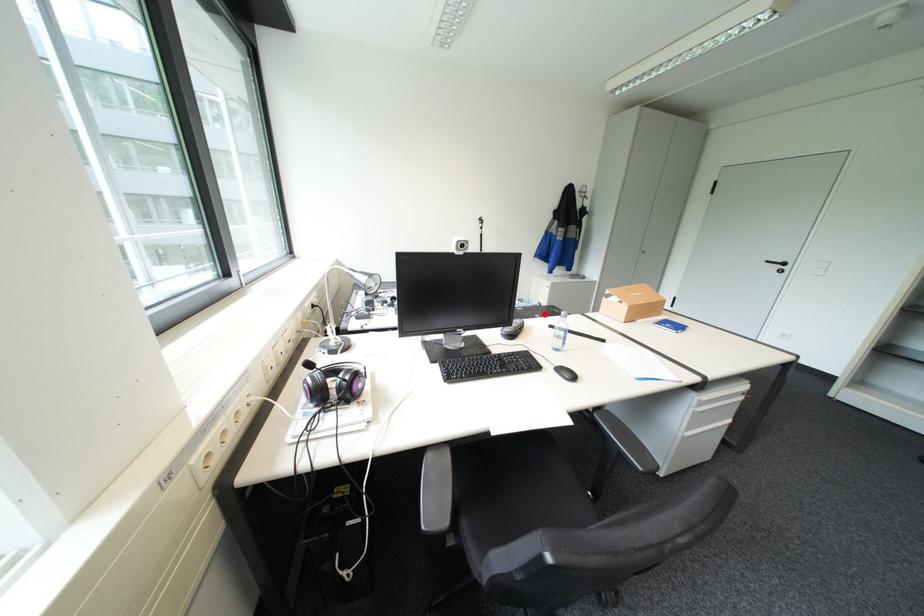
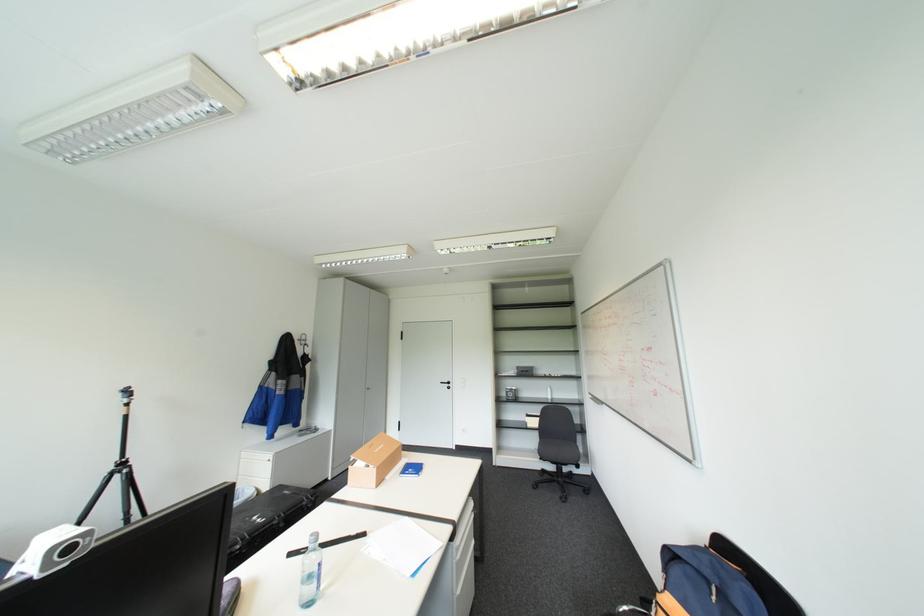
Find the pixel in the second image that matches the highlighted location in the first image.

(262, 517)